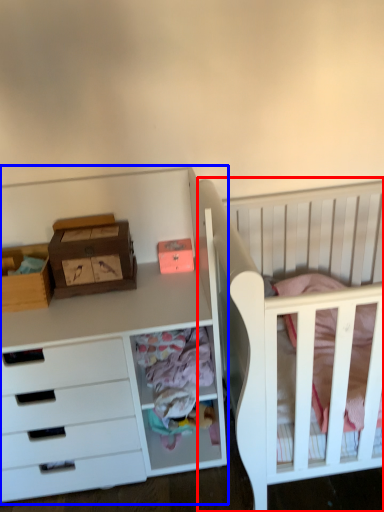
Question: Which object appears farthest to the camera in this image, infant bed (highlighted by a red box) or chest of drawers (highlighted by a blue box)?

Choices:
 (A) infant bed
 (B) chest of drawers

Answer: (B)